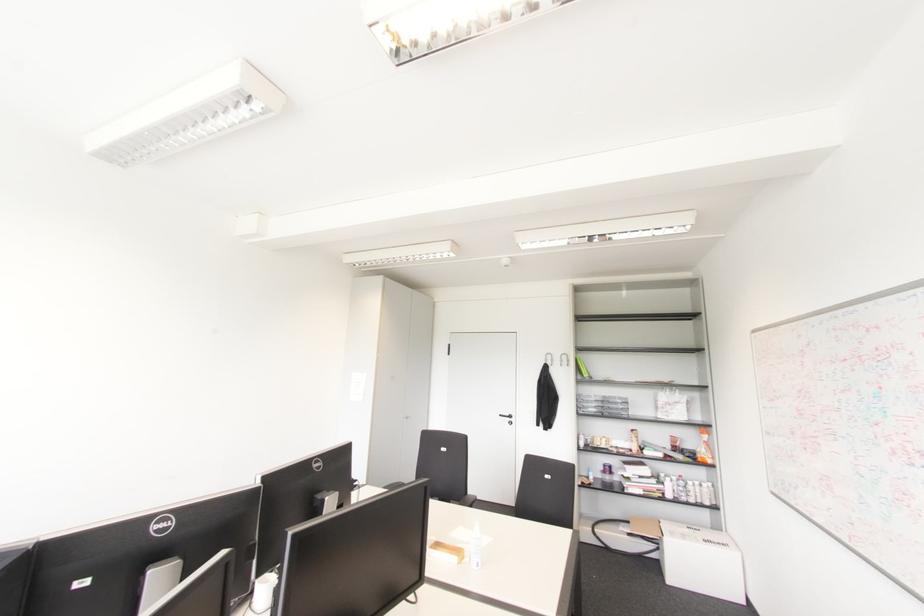
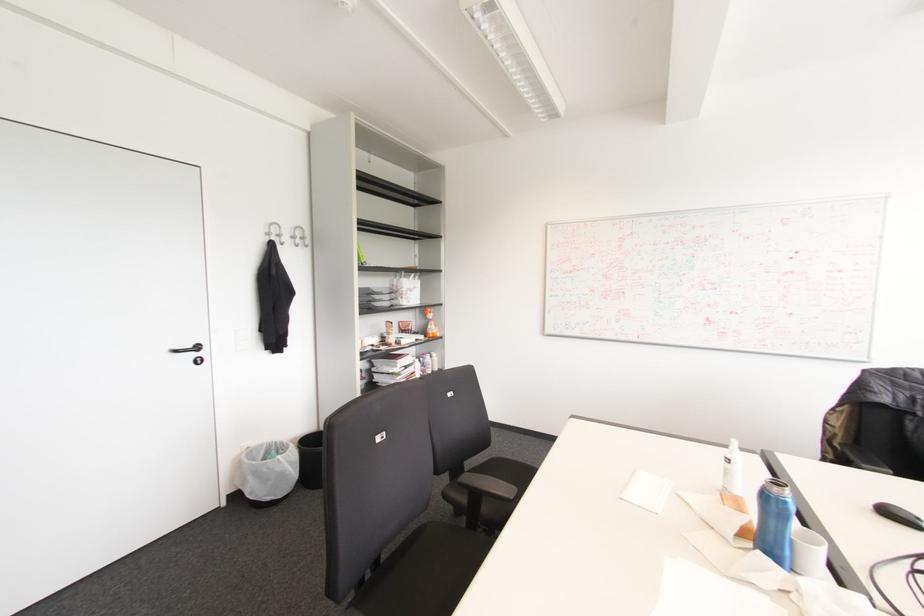
The point at (x=509, y=416) is marked in the first image. Where is the corresponding point in the second image?

(197, 347)